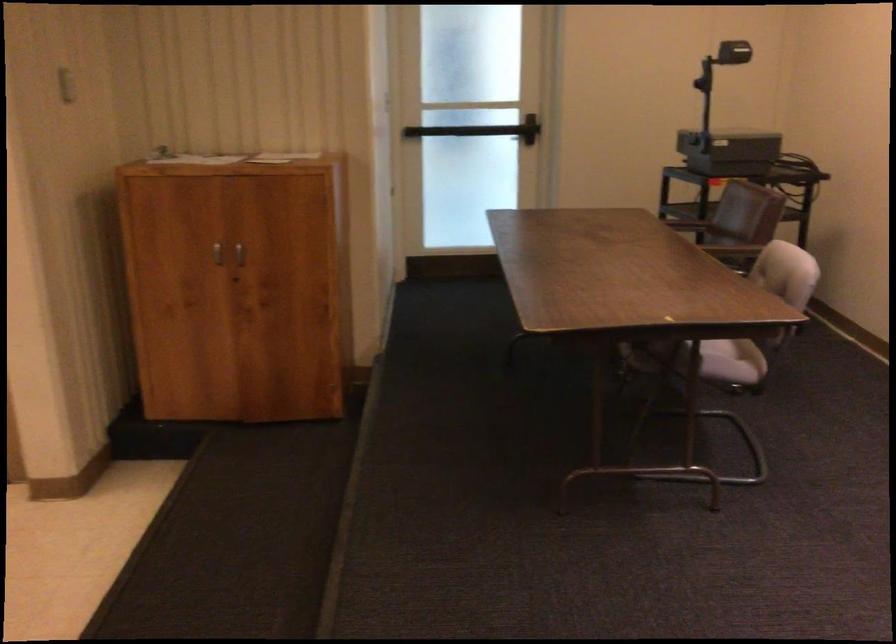
Find where to grasp the brown chair armrest. Please return your answer as a coordinate pair (x, y).

(731, 251)